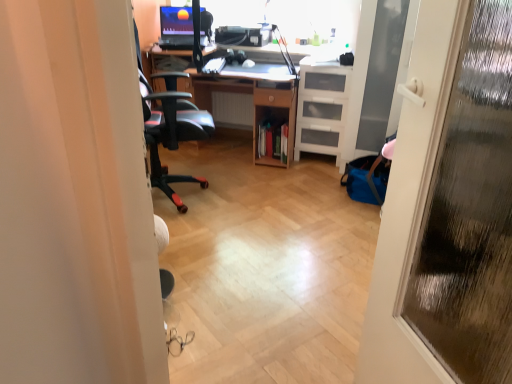
Question: From the image's perspective, relative to transparent glass screen door at right, is white plastic radiator at center above or below?

Choices:
 (A) below
 (B) above

Answer: (B)

Question: Considering the positions of point pos(232,97) and point pos(394,36), is point pos(232,97) closer or farther from the camera than point pos(394,36)?

Choices:
 (A) farther
 (B) closer

Answer: (A)

Question: Which object is the farthest from the white plastic drawers at right?

Choices:
 (A) matte black monitor at upper center
 (B) wooden desk at center
 (C) white plastic radiator at center
 (D) transparent glass screen door at right
 (E) transparent glass door at right

Answer: (E)

Question: Estimate the real-world distances between objects in this image. Which object is farther from the transparent glass door at right?

Choices:
 (A) white plastic drawers at right
 (B) transparent glass screen door at right
 (C) wooden desk at center
 (D) white plastic radiator at center
 (E) matte black monitor at upper center

Answer: (D)